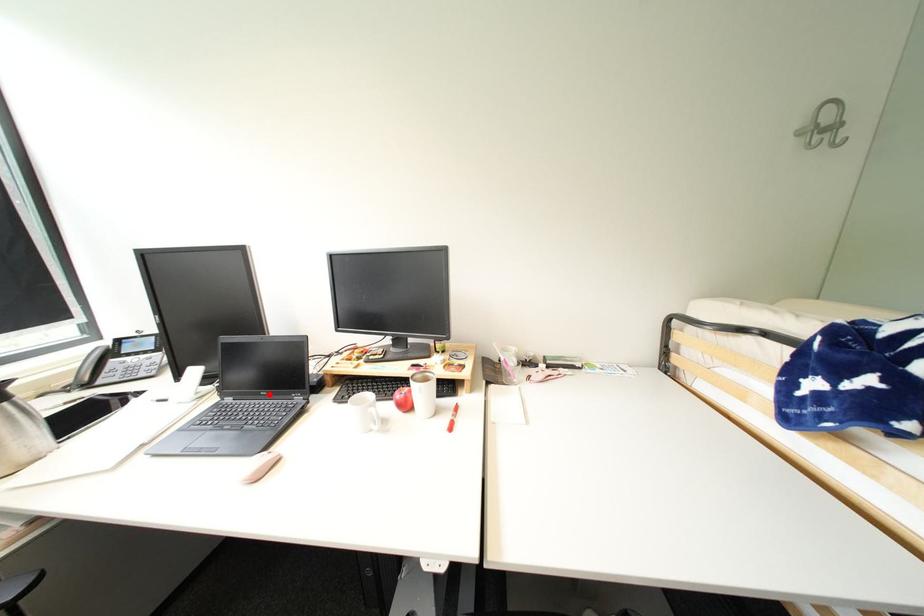
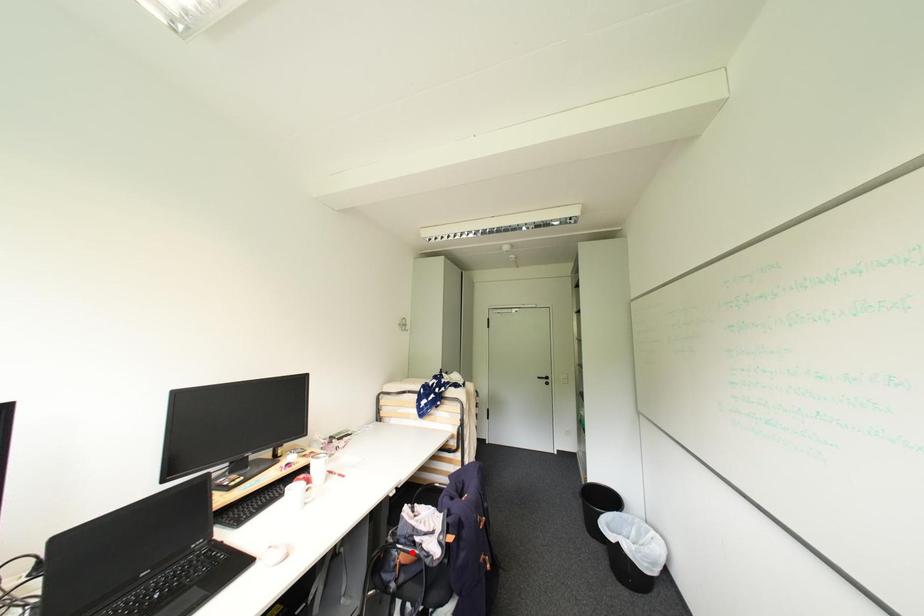
I am providing you with two images of the same scene from different viewpoints. A red point is marked on the first image and another point is marked on the second image. Is the marked point in image1 the same physical position as the marked point in image2?

No